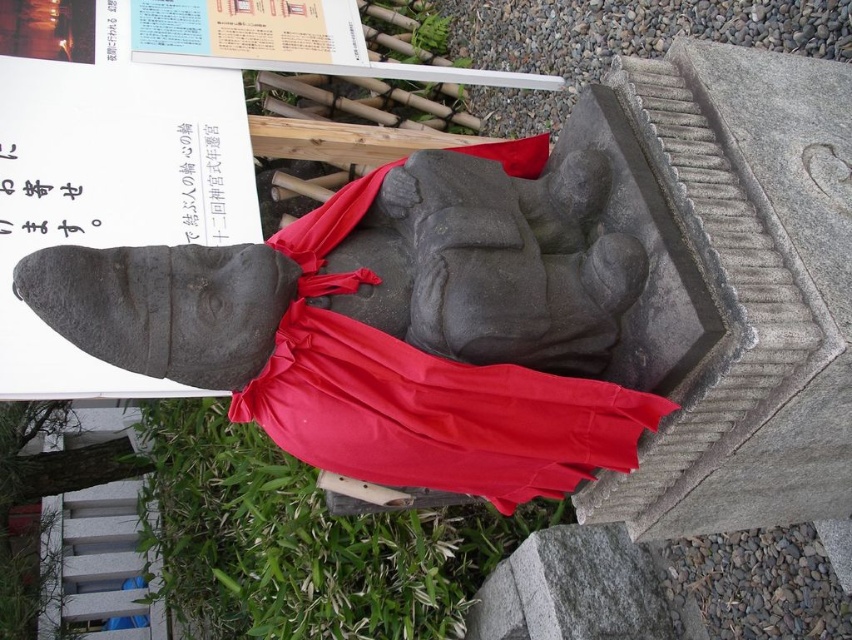
You are an artist observing the statue and notice two black paper items in the upper part of the image. Which of the two, the black paper at upper left or the black paper at upper center, is shorter in height?

The black paper at upper left is shorter than the black paper at upper center.

You are an archaeologist examining the statue. You need to document the exact location of the red fabric at center. What are its coordinates?

The red fabric at center is located at coordinates point (424, 392).